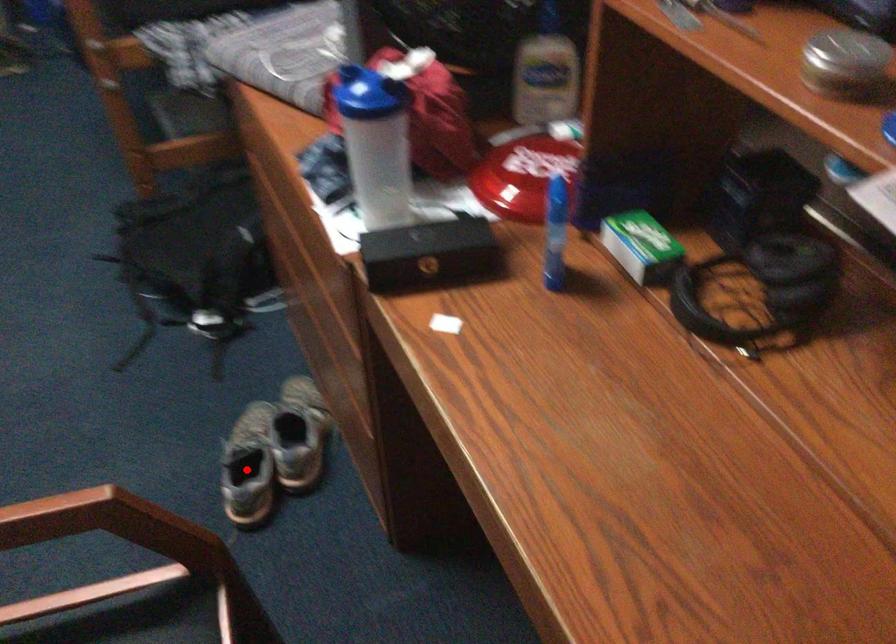
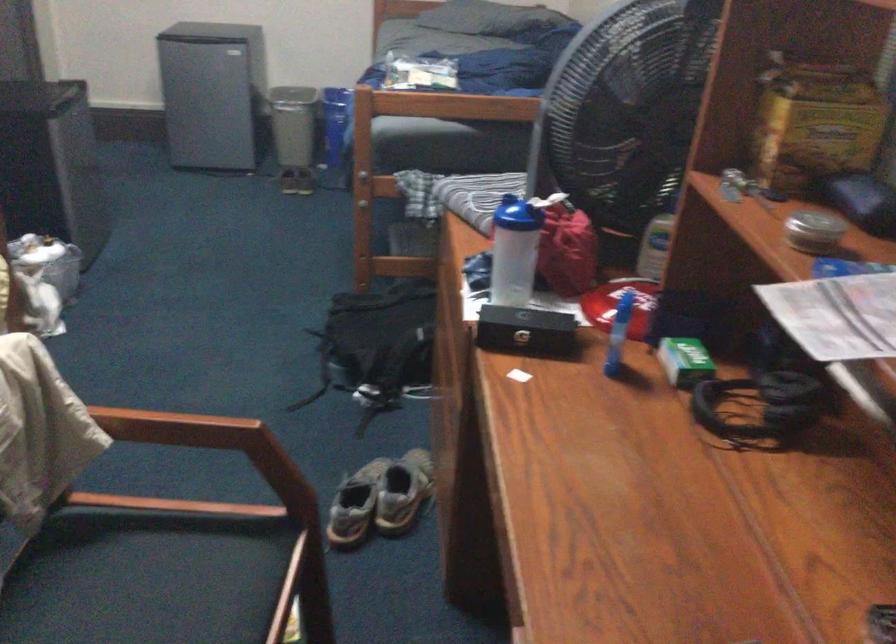
Question: I am providing you with two images of the same scene from different viewpoints. A red point is shown in image1. For the corresponding object point in image2, is it positioned nearer or farther from the camera?

Choices:
 (A) Nearer
 (B) Farther

Answer: (B)